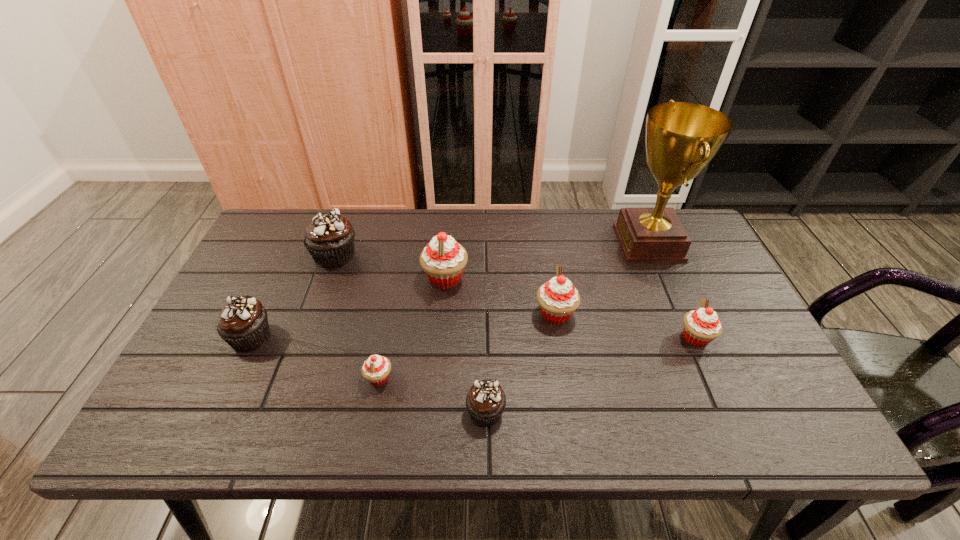
Where is `vacant space that's between the farthest brown cupcake and the tallest cupcake`? The height and width of the screenshot is (540, 960). vacant space that's between the farthest brown cupcake and the tallest cupcake is located at coordinates [x=390, y=267].

This screenshot has height=540, width=960. Find the location of `free space between the biggest pink cupcake and the nearest pink cupcake`. free space between the biggest pink cupcake and the nearest pink cupcake is located at coordinates (412, 328).

The image size is (960, 540). Identify the location of free space between the nearest pink cupcake and the tallest object. (514, 310).

Where is `vacant region between the third biggest pink cupcake and the sixth cupcake from left to right`? This screenshot has width=960, height=540. vacant region between the third biggest pink cupcake and the sixth cupcake from left to right is located at coordinates (626, 326).

Identify the location of vacant area between the fourth object from left to right and the second nearest cupcake. (412, 328).

I want to click on empty space between the leftmost object and the nearest pink cupcake, so click(315, 357).

This screenshot has height=540, width=960. What are the coordinates of `free spot between the sixth farthest cupcake and the gold award` in the screenshot? It's located at (514, 310).

Image resolution: width=960 pixels, height=540 pixels. What are the coordinates of `vacant area that lies between the farthest brown cupcake and the rightmost pink cupcake` in the screenshot? It's located at (516, 296).

At what (x,y) coordinates should I click in order to perform the action: click on object that stands as the fourth closest to the second smallest pink cupcake. Please return your answer as a coordinate pair (x, y). This screenshot has height=540, width=960. Looking at the image, I should click on (443, 260).

Select which object is the fourth closest to the fourth object from right to left. Please provide its 2D coordinates. Your answer should be formatted as a tuple, i.e. [(x, y)], where the tuple contains the x and y coordinates of a point satisfying the conditions above.

[(701, 326)]